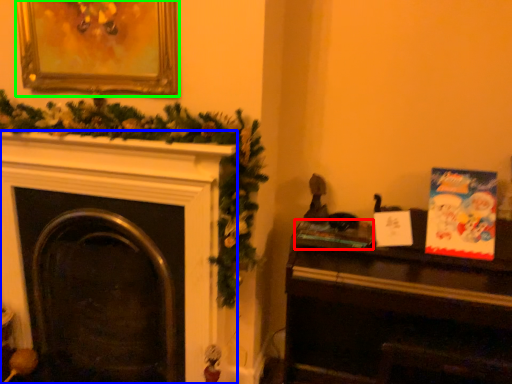
Question: Estimate the real-world distances between objects in this image. Which object is closer to book (highlighted by a red box), fireplace (highlighted by a blue box) or picture frame (highlighted by a green box)?

Choices:
 (A) fireplace
 (B) picture frame

Answer: (A)